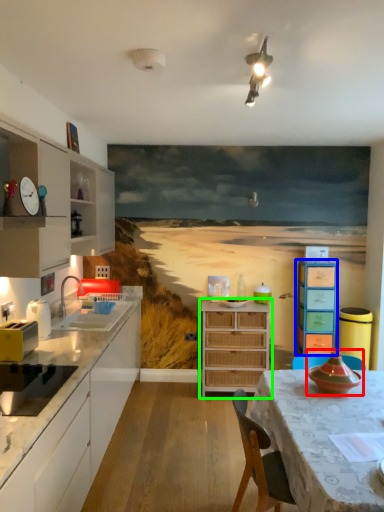
Question: Which is nearer to the appliance (highlighted by a red box)? chest of drawers (highlighted by a blue box) or chest of drawers (highlighted by a green box).

Choices:
 (A) chest of drawers
 (B) chest of drawers

Answer: (A)